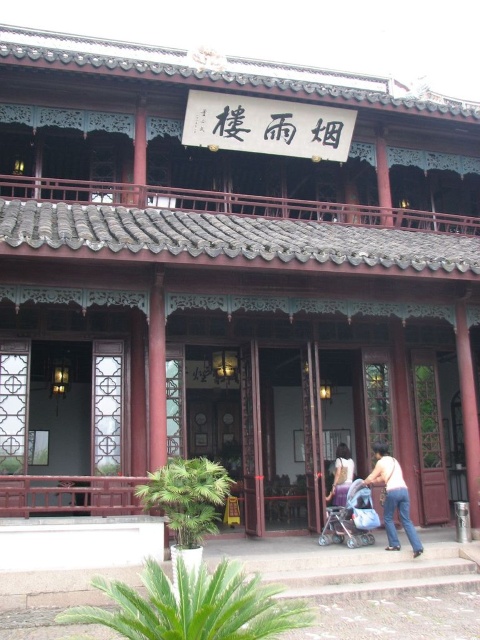
Which is above, jeans at center or blue fabric baby carriage at center?

jeans at center is above.

Is jeans at center to the left of blue fabric baby carriage at center from the viewer's perspective?

In fact, jeans at center is to the right of blue fabric baby carriage at center.

Is point (374, 474) less distant than point (364, 532)?

That is False.

The height and width of the screenshot is (640, 480). Find the location of `jeans at center`. jeans at center is located at coordinates (393, 497).